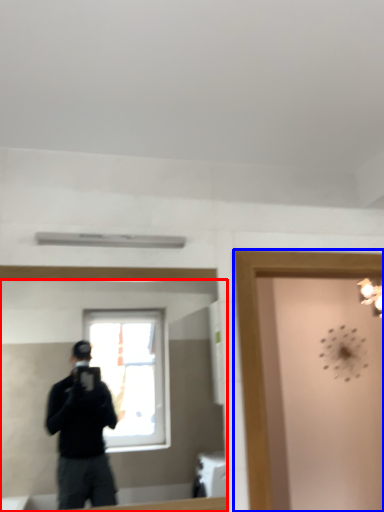
Question: Which of the following is the closest to the observer, mirror (highlighted by a red box) or glass door (highlighted by a blue box)?

Choices:
 (A) mirror
 (B) glass door

Answer: (A)